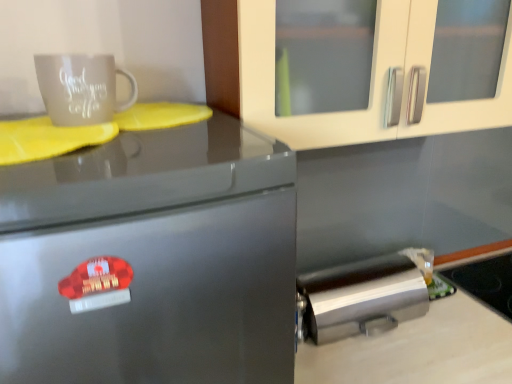
At what (x,y) coordinates should I click in order to perform the action: click on empty space that is ontop of smooth white countertop at lower right (from a real-world perspective). Please return your answer as a coordinate pair (x, y). The image size is (512, 384). Looking at the image, I should click on (445, 330).